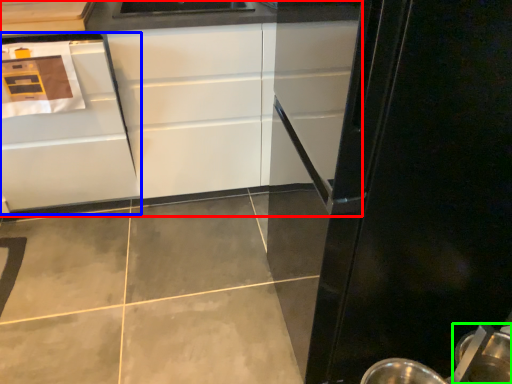
Question: Considering the real-world distances, which object is farthest from cabinetry (highlighted by a red box)? cabinetry (highlighted by a blue box) or appliance (highlighted by a green box)?

Choices:
 (A) cabinetry
 (B) appliance

Answer: (B)